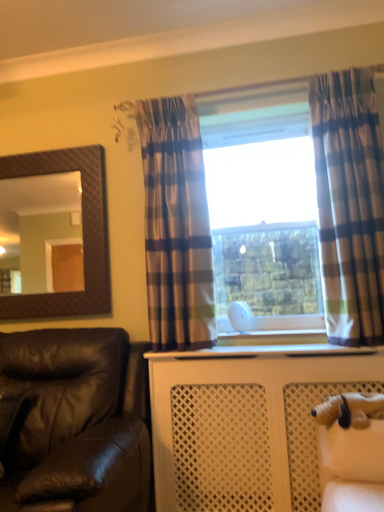
Where is `plaid fabric curtain at center, marked as the second curtain in a right-to-left arrangement`? The height and width of the screenshot is (512, 384). plaid fabric curtain at center, marked as the second curtain in a right-to-left arrangement is located at coordinates (176, 226).

Describe the element at coordinates (38, 225) in the screenshot. Image resolution: width=384 pixels, height=512 pixels. I see `brown textured mirror at upper left` at that location.

This screenshot has height=512, width=384. What do you see at coordinates (350, 410) in the screenshot? I see `white plush dog at lower right` at bounding box center [350, 410].

This screenshot has width=384, height=512. Describe the element at coordinates (75, 421) in the screenshot. I see `leather at left` at that location.

Describe the element at coordinates (349, 204) in the screenshot. I see `plaid fabric curtain at right, arranged as the 1th curtain when viewed from the right` at that location.

This screenshot has width=384, height=512. What are the coordinates of `white plastic window frame at center` in the screenshot? It's located at [263, 208].

The height and width of the screenshot is (512, 384). I want to click on plaid fabric curtain at center, marked as the second curtain in a right-to-left arrangement, so click(x=176, y=226).

Which is in front, plaid fabric curtain at center, marked as the 1th curtain in a left-to-right arrangement, or brown textured mirror at upper left?

plaid fabric curtain at center, marked as the 1th curtain in a left-to-right arrangement, is closer to the camera.

Does point (158, 291) come closer to viewer compared to point (54, 214)?

Yes, it is in front of point (54, 214).

Based on the photo, does plaid fabric curtain at center, marked as the 1th curtain in a left-to-right arrangement, have a greater height compared to brown textured mirror at upper left?

Yes, plaid fabric curtain at center, marked as the 1th curtain in a left-to-right arrangement, is taller than brown textured mirror at upper left.

Considering the relative sizes of plaid fabric curtain at center, marked as the second curtain in a right-to-left arrangement, and brown textured mirror at upper left in the image provided, is plaid fabric curtain at center, marked as the second curtain in a right-to-left arrangement, bigger than brown textured mirror at upper left?

Indeed, plaid fabric curtain at center, marked as the second curtain in a right-to-left arrangement, has a larger size compared to brown textured mirror at upper left.

Which object is wider, white plastic window frame at center or plaid fabric curtain at right, arranged as the 1th curtain when viewed from the right?

plaid fabric curtain at right, arranged as the 1th curtain when viewed from the right, is wider.

Can you see white plastic window frame at center touching plaid fabric curtain at right, marked as the second curtain in a left-to-right arrangement?

No, white plastic window frame at center is not next to plaid fabric curtain at right, marked as the second curtain in a left-to-right arrangement.

In terms of size, does white plastic window frame at center appear bigger or smaller than plaid fabric curtain at right, marked as the second curtain in a left-to-right arrangement?

In the image, white plastic window frame at center appears to be larger than plaid fabric curtain at right, marked as the second curtain in a left-to-right arrangement.

From the image's perspective, is white plastic window frame at center on plaid fabric curtain at right, marked as the second curtain in a left-to-right arrangement?

No, from the image's perspective, white plastic window frame at center is not over plaid fabric curtain at right, marked as the second curtain in a left-to-right arrangement.

From a real-world perspective, which object rests below the other?

brown textured mirror at upper left.

Considering the sizes of objects brown textured mirror at upper left and white plastic window frame at center in the image provided, who is bigger, brown textured mirror at upper left or white plastic window frame at center?

white plastic window frame at center.

What's the angular difference between brown textured mirror at upper left and white plastic window frame at center's facing directions?

There is a 0.336-degree angle between the facing directions of brown textured mirror at upper left and white plastic window frame at center.

Is point (325, 180) closer or farther from the camera than point (326, 411)?

Point (325, 180) is positioned farther from the camera compared to point (326, 411).

Looking at the image, does plaid fabric curtain at right, arranged as the 1th curtain when viewed from the right, seem bigger or smaller compared to white plush dog at lower right?

Clearly, plaid fabric curtain at right, arranged as the 1th curtain when viewed from the right, is larger in size than white plush dog at lower right.

Is plaid fabric curtain at right, arranged as the 1th curtain when viewed from the right, positioned far away from white plush dog at lower right?

No, plaid fabric curtain at right, arranged as the 1th curtain when viewed from the right, is in close proximity to white plush dog at lower right.

Does plaid fabric curtain at right, marked as the second curtain in a left-to-right arrangement, have a greater height compared to white plush dog at lower right?

Yes, plaid fabric curtain at right, marked as the second curtain in a left-to-right arrangement, is taller than white plush dog at lower right.

Is white plastic window frame at center facing away from leather at left?

No, white plastic window frame at center is not facing the opposite direction of leather at left.

What's the angular difference between white plastic window frame at center and leather at left's facing directions?

The angular difference between white plastic window frame at center and leather at left is 0.948 degrees.

Is white plastic window frame at center far away from leather at left?

Absolutely, white plastic window frame at center is distant from leather at left.

Considering the positions of objects white plastic window frame at center and leather at left in the image provided, who is in front, white plastic window frame at center or leather at left?

Positioned in front is leather at left.

Can you tell me how much brown textured mirror at upper left and white plush dog at lower right differ in facing direction?

The angle between the facing direction of brown textured mirror at upper left and the facing direction of white plush dog at lower right is 87.3 degrees.

Considering the relative sizes of brown textured mirror at upper left and white plush dog at lower right in the image provided, is brown textured mirror at upper left wider than white plush dog at lower right?

Incorrect, the width of brown textured mirror at upper left does not surpass that of white plush dog at lower right.

Based on the photo, in terms of height, does brown textured mirror at upper left look taller or shorter compared to white plush dog at lower right?

Considering their sizes, brown textured mirror at upper left has more height than white plush dog at lower right.

Is leather at left not within brown textured mirror at upper left?

leather at left is positioned outside brown textured mirror at upper left.

From the picture: From the image's perspective, does leather at left appear higher than brown textured mirror at upper left?

Actually, leather at left appears below brown textured mirror at upper left in the image.

In the scene shown: From a real-world perspective, relative to brown textured mirror at upper left, is leather at left vertically above or below?

From a real-world perspective, leather at left is physically below brown textured mirror at upper left.

The height and width of the screenshot is (512, 384). I want to click on mirror positioned vertically above the plaid fabric curtain at center, marked as the second curtain in a right-to-left arrangement (from a real-world perspective), so click(x=38, y=225).

Where is `window frame lying below the plaid fabric curtain at right, arranged as the 1th curtain when viewed from the right (from the image's perspective)`? The width and height of the screenshot is (384, 512). window frame lying below the plaid fabric curtain at right, arranged as the 1th curtain when viewed from the right (from the image's perspective) is located at coordinates (263, 208).

Based on the photo, considering their positions, is brown textured mirror at upper left positioned further to white plastic window frame at center than white plush dog at lower right?

brown textured mirror at upper left is further to white plastic window frame at center.

Considering their positions, is brown textured mirror at upper left positioned further to plaid fabric curtain at right, arranged as the 1th curtain when viewed from the right, than plaid fabric curtain at center, marked as the second curtain in a right-to-left arrangement?

The object further to plaid fabric curtain at right, arranged as the 1th curtain when viewed from the right, is brown textured mirror at upper left.

Estimate the real-world distances between objects in this image. Which object is further from plaid fabric curtain at center, marked as the 1th curtain in a left-to-right arrangement, brown textured mirror at upper left or plaid fabric curtain at right, arranged as the 1th curtain when viewed from the right?

brown textured mirror at upper left is further to plaid fabric curtain at center, marked as the 1th curtain in a left-to-right arrangement.

Considering their positions, is plaid fabric curtain at right, marked as the second curtain in a left-to-right arrangement, positioned closer to white plush dog at lower right than plaid fabric curtain at center, marked as the second curtain in a right-to-left arrangement?

Based on the image, plaid fabric curtain at right, marked as the second curtain in a left-to-right arrangement, appears to be nearer to white plush dog at lower right.

From the image, which object appears to be farther from plaid fabric curtain at right, arranged as the 1th curtain when viewed from the right, leather at left or white plastic window frame at center?

Based on the image, leather at left appears to be further to plaid fabric curtain at right, arranged as the 1th curtain when viewed from the right.

Looking at the image, which one is located further to white plush dog at lower right, plaid fabric curtain at center, marked as the second curtain in a right-to-left arrangement, or white plastic window frame at center?

white plastic window frame at center.

Estimate the real-world distances between objects in this image. Which object is further from leather at left, white plastic window frame at center or brown textured mirror at upper left?

The object further to leather at left is brown textured mirror at upper left.

When comparing their distances from brown textured mirror at upper left, does white plush dog at lower right or white plastic window frame at center seem further?

Based on the image, white plush dog at lower right appears to be further to brown textured mirror at upper left.

Where is `animal between brown textured mirror at upper left and plaid fabric curtain at right, marked as the second curtain in a left-to-right arrangement, in the horizontal direction`? animal between brown textured mirror at upper left and plaid fabric curtain at right, marked as the second curtain in a left-to-right arrangement, in the horizontal direction is located at coordinates (350, 410).

This screenshot has width=384, height=512. I want to click on curtain between plaid fabric curtain at right, arranged as the 1th curtain when viewed from the right, and white plush dog at lower right, in the vertical direction, so click(x=176, y=226).

The width and height of the screenshot is (384, 512). I want to click on curtain between white plastic window frame at center and leather at left in the vertical direction, so click(x=176, y=226).

The image size is (384, 512). Find the location of `curtain between brown textured mirror at upper left and plaid fabric curtain at right, arranged as the 1th curtain when viewed from the right, in the horizontal direction`. curtain between brown textured mirror at upper left and plaid fabric curtain at right, arranged as the 1th curtain when viewed from the right, in the horizontal direction is located at coordinates (176, 226).